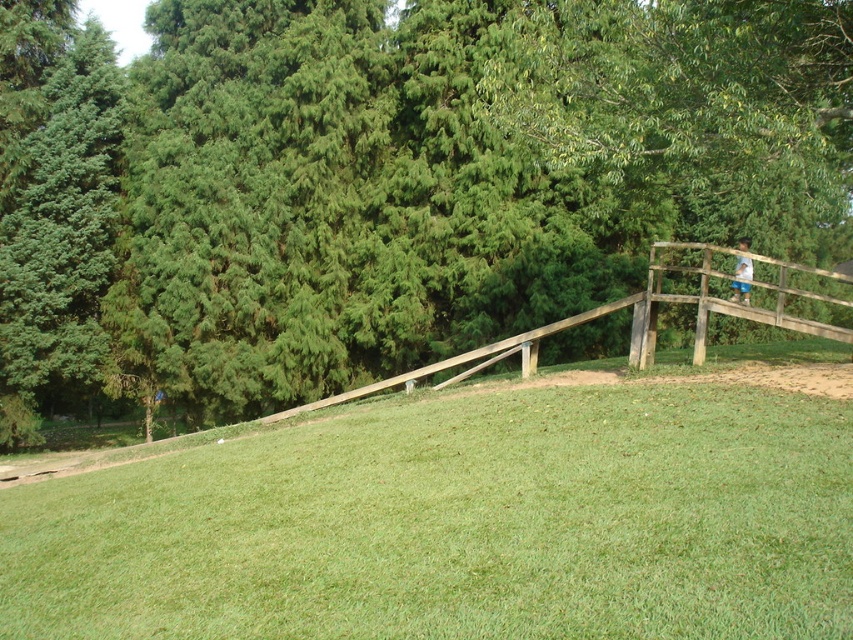
Question: Which point is farther to the camera?

Choices:
 (A) (737, 275)
 (B) (337, 588)
 (C) (514, 340)
 (D) (109, 122)

Answer: (D)

Question: Does green grassy at center appear on the left side of blue denim shorts at upper right?

Choices:
 (A) no
 (B) yes

Answer: (B)

Question: Which object is positioned farthest from the green leafy tree at upper center?

Choices:
 (A) green grassy at center
 (B) wooden rail at right

Answer: (A)

Question: Can you confirm if green leafy tree at upper center is thinner than wooden rail at right?

Choices:
 (A) yes
 (B) no

Answer: (B)

Question: Considering the relative positions of green grassy at center and wooden rail at right in the image provided, where is green grassy at center located with respect to wooden rail at right?

Choices:
 (A) above
 (B) below

Answer: (B)

Question: Which point appears closest to the camera in this image?

Choices:
 (A) (749, 269)
 (B) (439, 29)
 (C) (630, 307)
 (D) (807, 458)

Answer: (D)